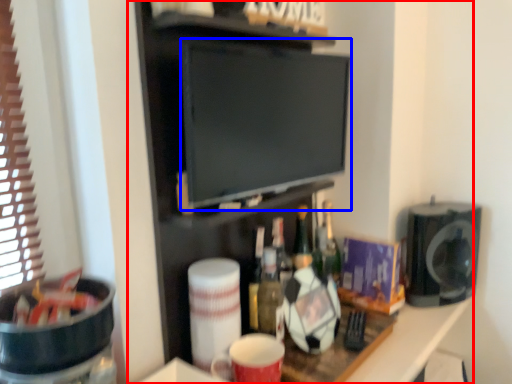
Question: Among these objects, which one is nearest to the camera, entertainment center (highlighted by a red box) or flat (highlighted by a blue box)?

Choices:
 (A) entertainment center
 (B) flat

Answer: (A)